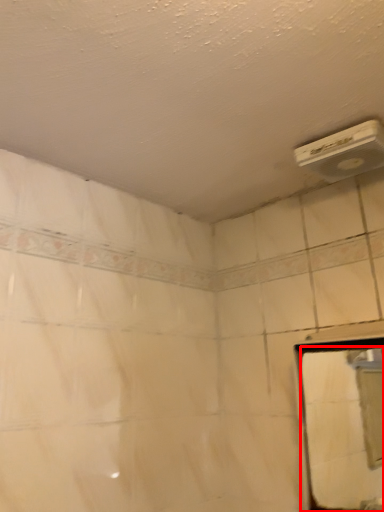
Question: Where is mirror (annotated by the red box) located in relation to air conditioning in the image?

Choices:
 (A) right
 (B) left

Answer: (A)